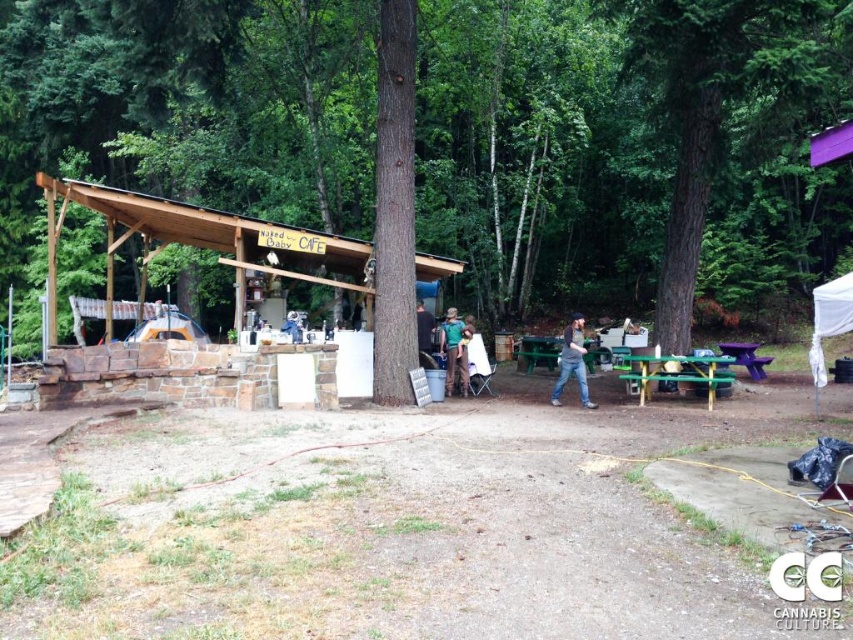
You are standing at the campsite and want to take a photo of both the red hose and the wooden structure. You notice two points marked on your map at coordinates point (537, 301) and point (451, 365). Which point should you stand at to ensure both objects are in frame and properly focused?

You should stand at point (537, 301) because it is closer to the camera, allowing both the red hose and the wooden structure to be in focus simultaneously.

You are setting up a picnic and need to place a blanket on the green painted wood picnic table at center and the orange fabric tent at center. Which object should you place the blanket on first if you want to start from the left side of the area?

The orange fabric tent at center is on the left side of the green painted wood picnic table at center, so you should place the blanket on the orange fabric tent at center first.

You are standing at the campsite and want to determine the relative positions of two points marked in the image. Which point is closer to you, point 1 at coordinates [645,362] or point 2 at coordinates [560,349]?

Point 1 at coordinates [645,362] is closer to the viewer than point 2 at coordinates [560,349].